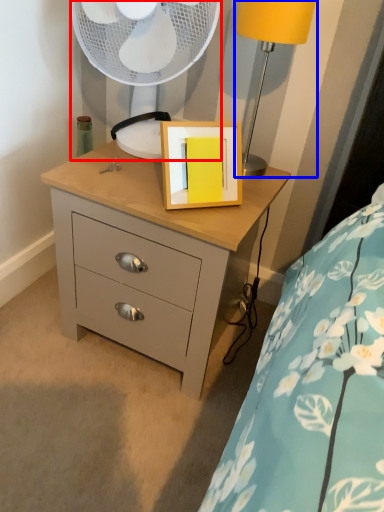
Question: Among these objects, which one is farthest to the camera, mechanical fan (highlighted by a red box) or table lamp (highlighted by a blue box)?

Choices:
 (A) mechanical fan
 (B) table lamp

Answer: (A)